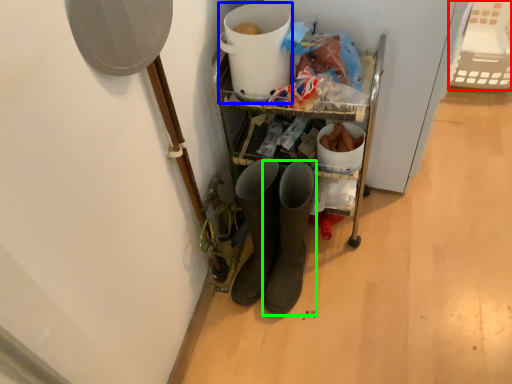
Question: Which object is positioned farthest from basket (highlighted by a red box)? Select from appliance (highlighted by a blue box) and footwear (highlighted by a green box).

Choices:
 (A) appliance
 (B) footwear

Answer: (B)